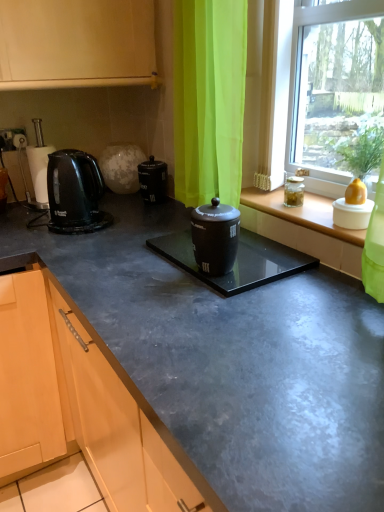
Question: Is matte black coffee canister at center smaller than black plastic kettle at left?

Choices:
 (A) no
 (B) yes

Answer: (A)

Question: Is matte black coffee canister at center bigger than black plastic kettle at left?

Choices:
 (A) yes
 (B) no

Answer: (A)

Question: Is matte black coffee canister at center touching black plastic kettle at left?

Choices:
 (A) yes
 (B) no

Answer: (B)

Question: Is matte black coffee canister at center outside black plastic kettle at left?

Choices:
 (A) yes
 (B) no

Answer: (A)

Question: Would you say matte black coffee canister at center contains black plastic kettle at left?

Choices:
 (A) yes
 (B) no

Answer: (B)

Question: From a real-world perspective, is matte black coffee canister at center under black plastic kettle at left?

Choices:
 (A) yes
 (B) no

Answer: (A)

Question: Is black plastic kettle at left wider than black glossy container at center?

Choices:
 (A) no
 (B) yes

Answer: (A)

Question: From a real-world perspective, is black plastic kettle at left over black glossy container at center?

Choices:
 (A) no
 (B) yes

Answer: (B)

Question: Would you consider black plastic kettle at left to be distant from black glossy container at center?

Choices:
 (A) yes
 (B) no

Answer: (B)

Question: From the image's perspective, does black plastic kettle at left appear higher than black glossy container at center?

Choices:
 (A) no
 (B) yes

Answer: (B)

Question: Does black plastic kettle at left appear on the right side of black glossy container at center?

Choices:
 (A) no
 (B) yes

Answer: (A)

Question: Is black plastic kettle at left at the left side of black glossy container at center?

Choices:
 (A) no
 (B) yes

Answer: (B)

Question: Can you confirm if transparent glass window at center is taller than black plastic kettle at left?

Choices:
 (A) yes
 (B) no

Answer: (A)